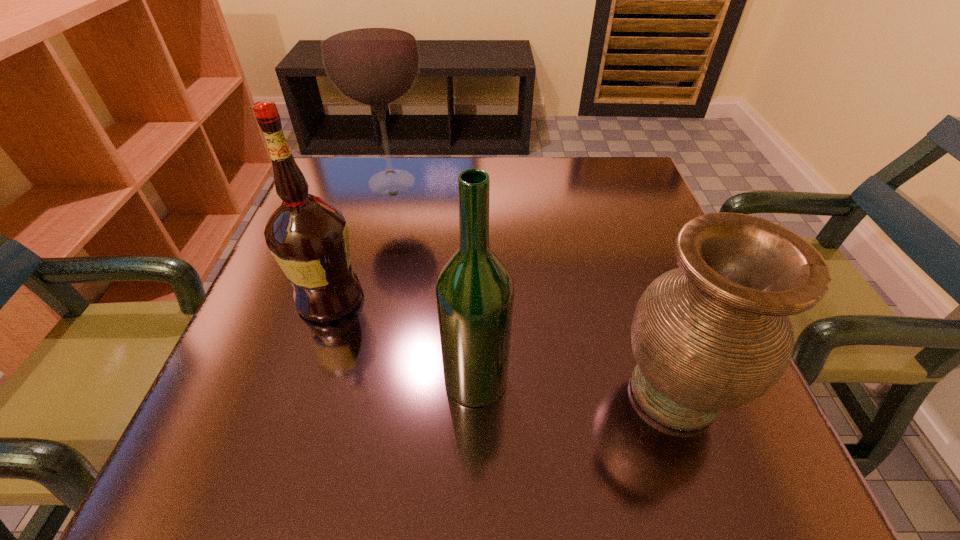
The width and height of the screenshot is (960, 540). I want to click on vacant area that satisfies the following two spatial constraints: 1. on the label of the third nearest object; 2. on the right side of the vase, so click(300, 392).